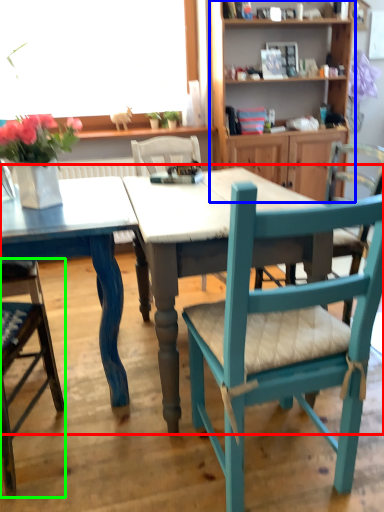
Question: Which is nearer to the kitchen & dining room table (highlighted by a red box)? shelf (highlighted by a blue box) or chair (highlighted by a green box).

Choices:
 (A) shelf
 (B) chair

Answer: (B)